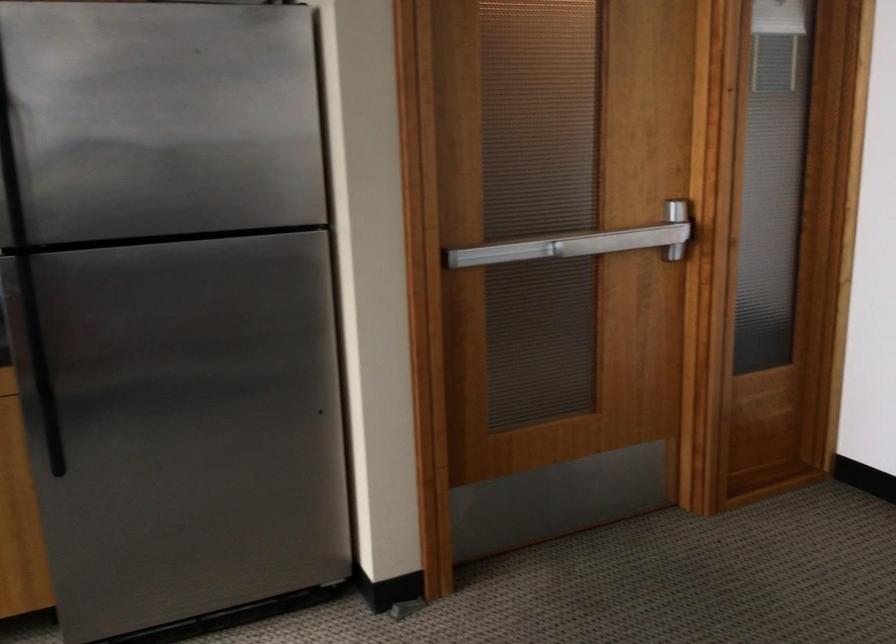
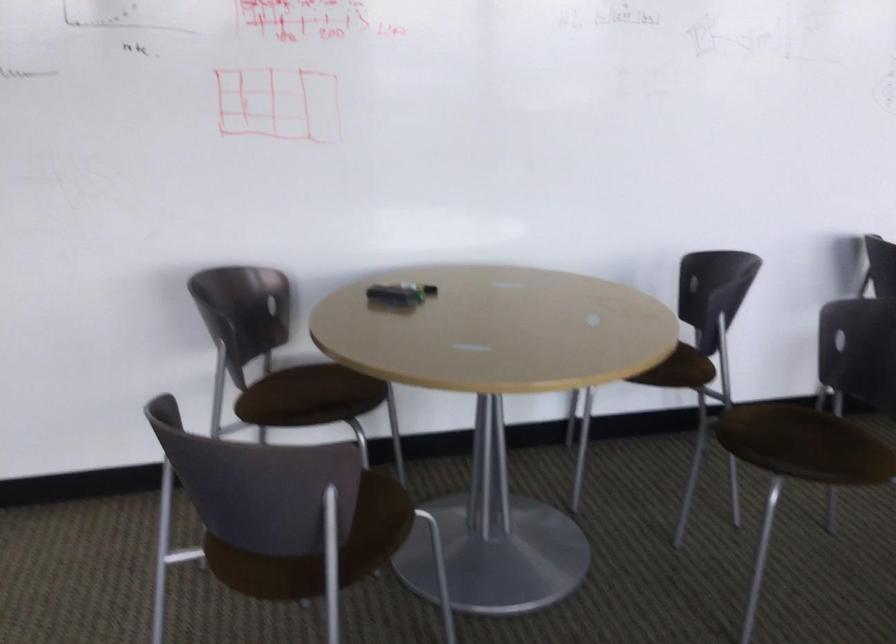
Question: Based on the continuous images, in which direction is the camera rotating? Reply with the corresponding letter.

Choices:
 (A) Left
 (B) Right
 (C) Up
 (D) Down

Answer: (B)